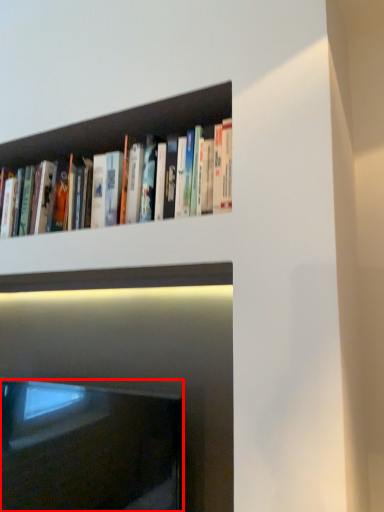
Question: Considering the relative positions of fireplace (annotated by the red box) and book in the image provided, where is fireplace (annotated by the red box) located with respect to the staircase?

Choices:
 (A) left
 (B) right

Answer: (A)